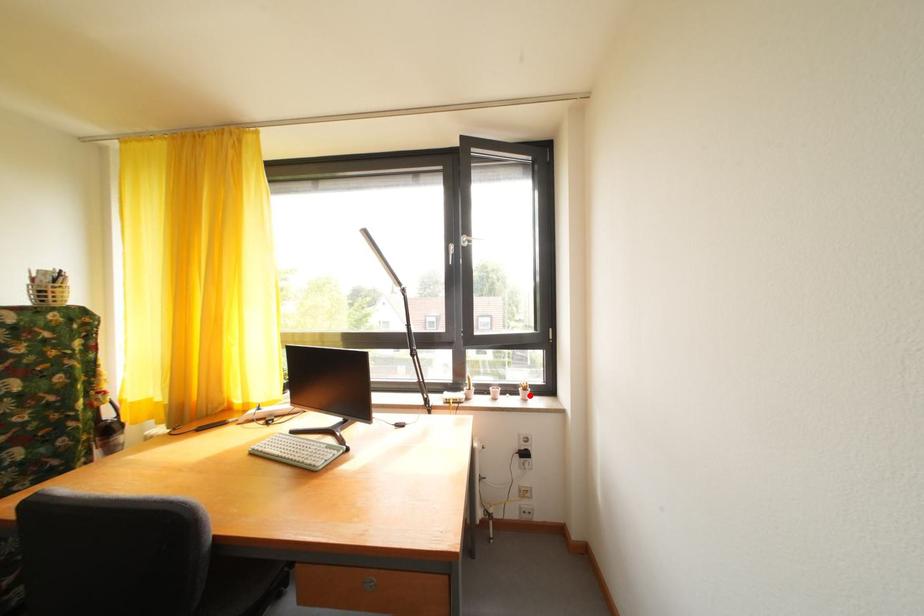
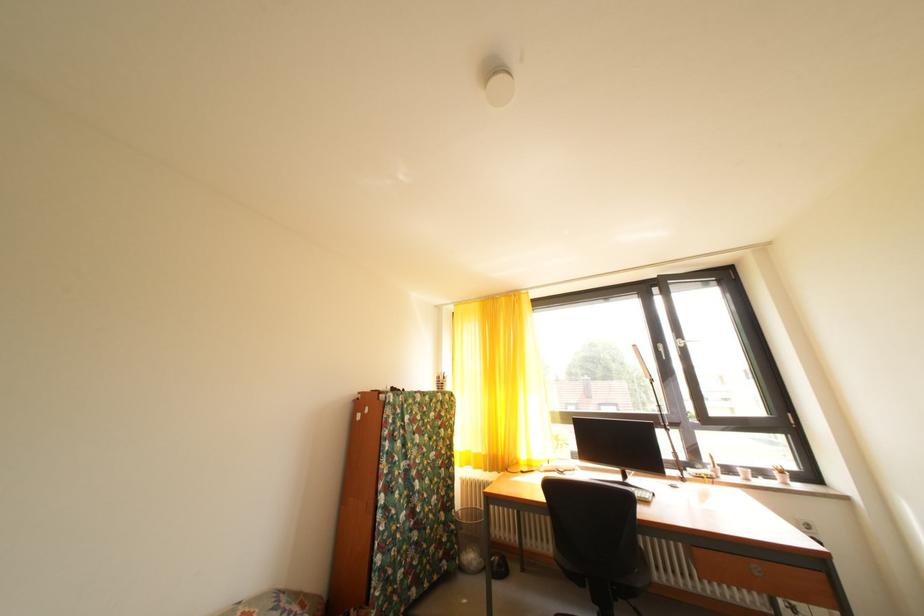
Question: I am providing you with two images of the same scene from different viewpoints. A red point is marked on the first image. Can you still see the location of the red point in image 2?

Choices:
 (A) Yes
 (B) No

Answer: (A)